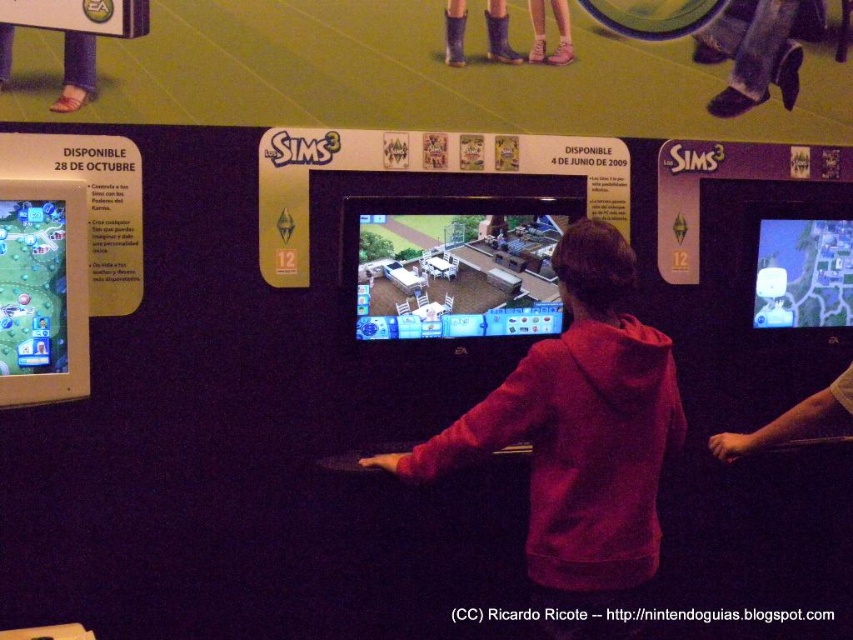
Question: Is matte plastic screen at center smaller than leather boots at upper left?

Choices:
 (A) no
 (B) yes

Answer: (A)

Question: Estimate the real-world distances between objects in this image. Which object is farther from the white matte hand at center?

Choices:
 (A) matte blue map at center
 (B) matte green map at left
 (C) leather boots at upper center

Answer: (B)

Question: Does matte blue map at center appear over purple rubber boots at upper center?

Choices:
 (A) no
 (B) yes

Answer: (A)

Question: Which point is closer to the camera taking this photo?

Choices:
 (A) (451, 13)
 (B) (844, 317)

Answer: (A)

Question: Considering the relative positions of purple rubber boots at upper center and leather boots at upper center in the image provided, where is purple rubber boots at upper center located with respect to leather boots at upper center?

Choices:
 (A) left
 (B) right

Answer: (A)

Question: Which point is closer to the camera taking this photo?

Choices:
 (A) (782, 417)
 (B) (447, 6)
 (C) (561, 49)

Answer: (A)